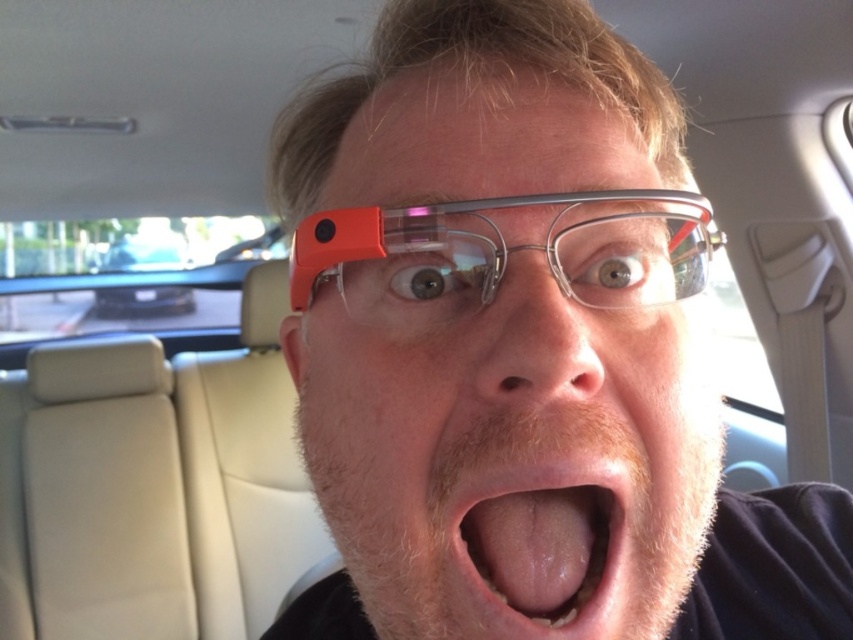
You are a passenger in the car and want to place your matte orange glasses at center on the seat. The car seat has a coordinate system where the bottom left corner is the origin point. The seat is 1 meter in width and 1 meter in height. Can you place the glasses at the given coordinates?

The matte orange glasses at center are positioned at coordinates point (506, 449), which is within the seat dimensions of 1 meter width and height. Therefore, you can place the matte orange glasses at center at those coordinates.

You are a driver in a car and you see a point at coordinates (506, 449). What object is located at that point?

The point at coordinates (506, 449) corresponds to the matte orange glasses at center.